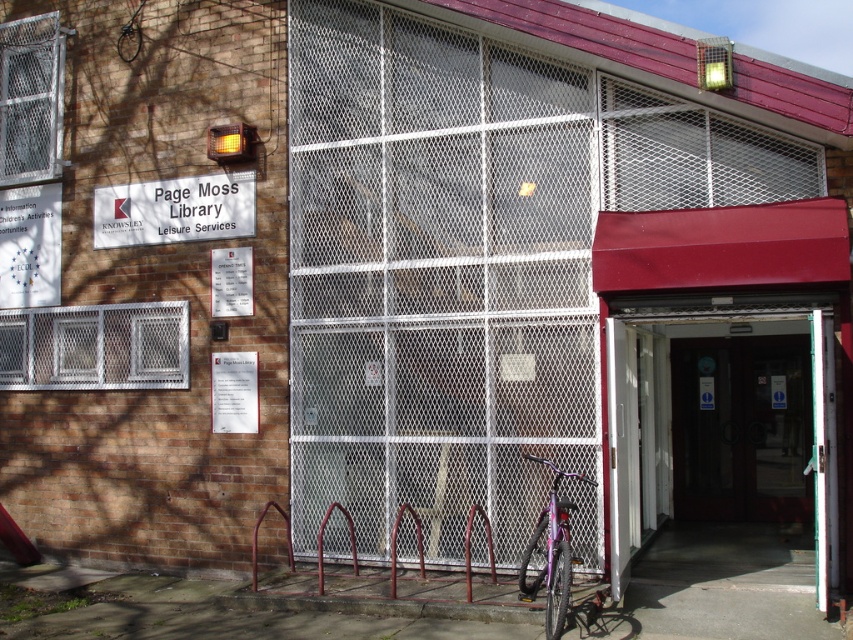
You are a delivery person arriving at Page Moss Library. You need to park your matte purple bicycle at lower center near the white plastic sign at upper left. Is there enough space to park the bicycle next to the sign?

The white plastic sign at upper left occupies less space than matte purple bicycle at lower center, so there might not be enough space to park the bicycle next to the sign without overlapping.

You are standing at the entrance of Page Moss Library and want to locate the white plastic sign at upper left. Which direction should you look to find it?

The white plastic sign at upper left is located at point (175, 209), so you should look to the upper left direction to find it.

Looking at this image, you are standing in front of Page Moss Library and want to read the white plastic sign at upper left. There is a matte purple bicycle at lower center blocking your view. Can you see the sign without moving around the bicycle?

The white plastic sign at upper left is further to the viewer than the matte purple bicycle at lower center, so the bicycle is closer to you and blocking your view. You need to move around the bicycle to see the sign.